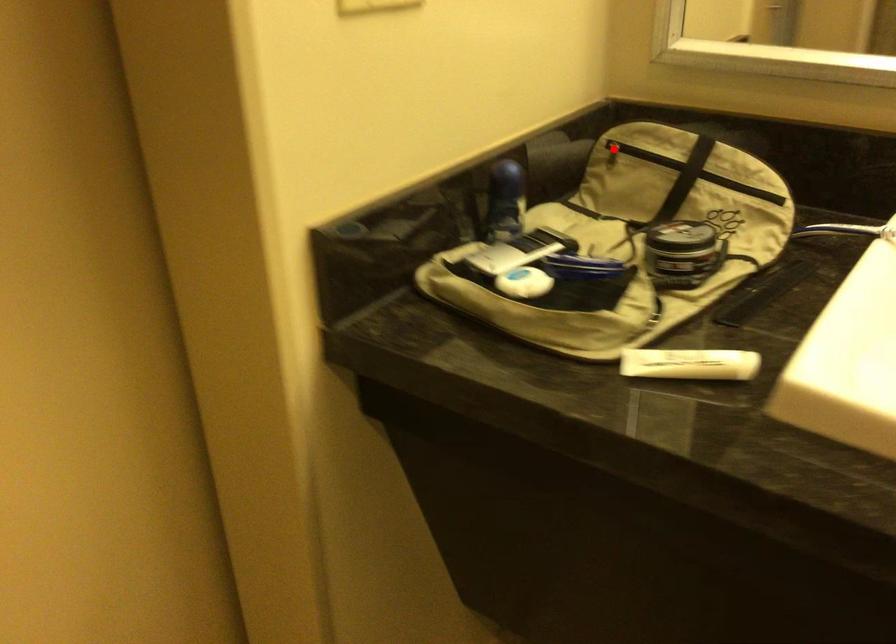
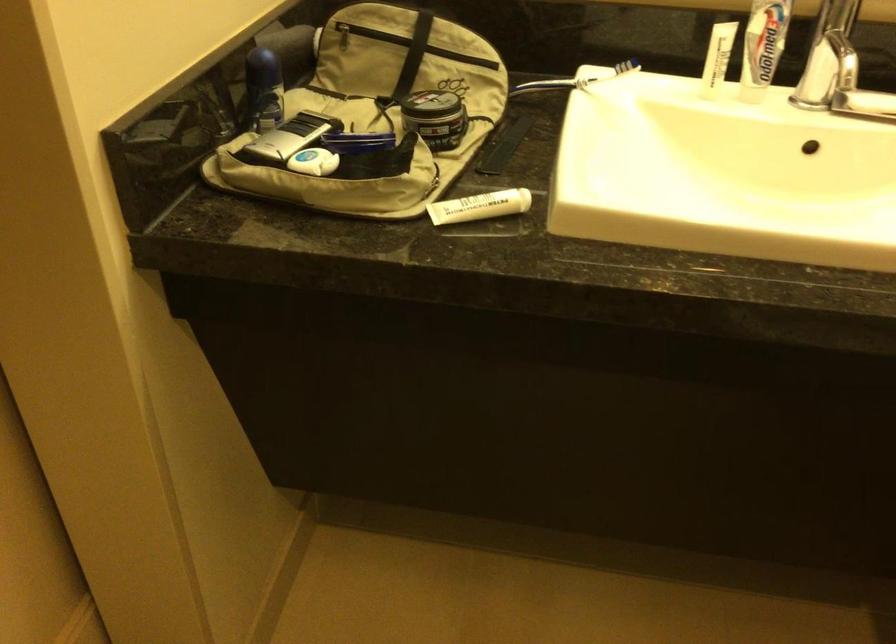
The point at the highlighted location is marked in the first image. Where is the corresponding point in the second image?

(341, 33)